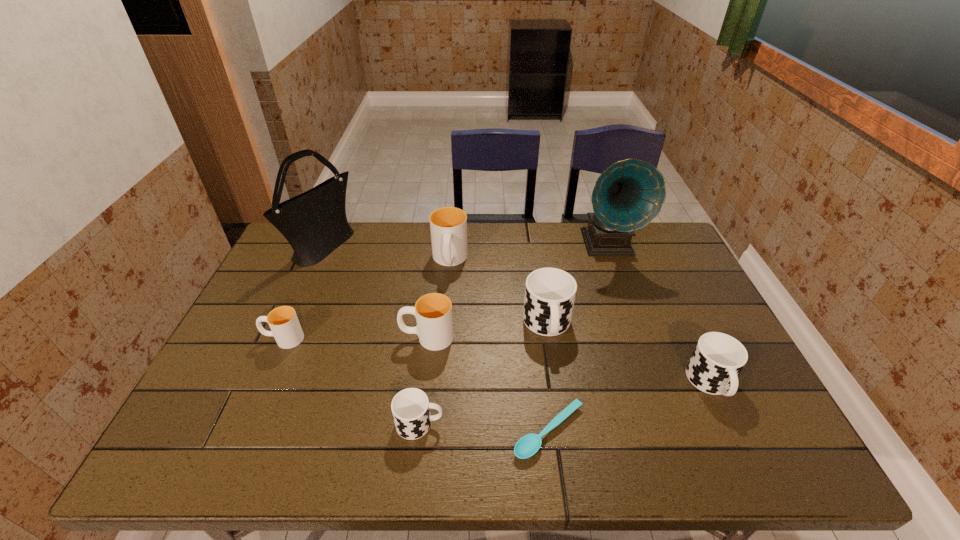
This screenshot has width=960, height=540. I want to click on vacant space located with the handle on the side of the second smallest yellow cup, so click(x=308, y=337).

Find the location of a particular element. The image size is (960, 540). blank space located on the side of the rightmost cup with the handle is located at coordinates (749, 463).

Locate an element on the screen. vacant space located 0.090m with the handle on the side of the leftmost cup is located at coordinates (230, 339).

The width and height of the screenshot is (960, 540). What are the coordinates of `vacant space located on the side of the smallest black cup with the handle` in the screenshot? It's located at (x=474, y=424).

The image size is (960, 540). Identify the location of vacant area situated 0.090m on the right of the blue spoon. (626, 431).

Find the location of a particular element. The width and height of the screenshot is (960, 540). phonograph_record present at the far edge is located at coordinates (629, 194).

Locate an element on the screen. shoulder bag present at the far edge is located at coordinates (314, 223).

Where is `cup situated at the far edge`? This screenshot has height=540, width=960. cup situated at the far edge is located at coordinates (448, 225).

In order to click on cup present at the near edge in this screenshot , I will do `click(410, 407)`.

Image resolution: width=960 pixels, height=540 pixels. In order to click on spoon at the near edge in this screenshot , I will do `click(528, 445)`.